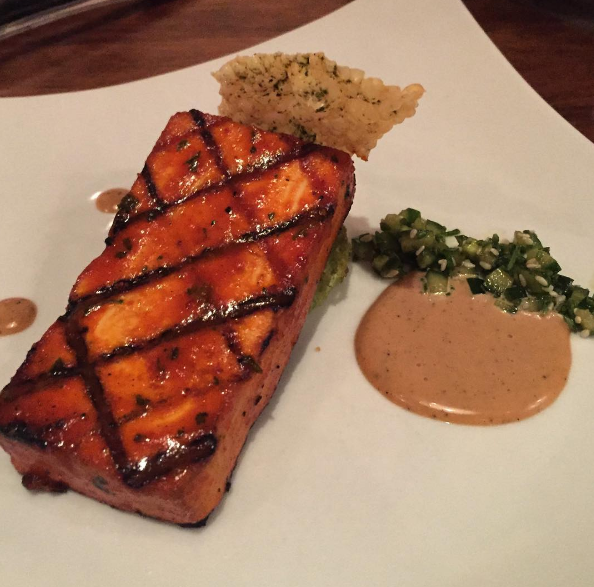
The width and height of the screenshot is (594, 587). I want to click on table, so click(x=251, y=32).